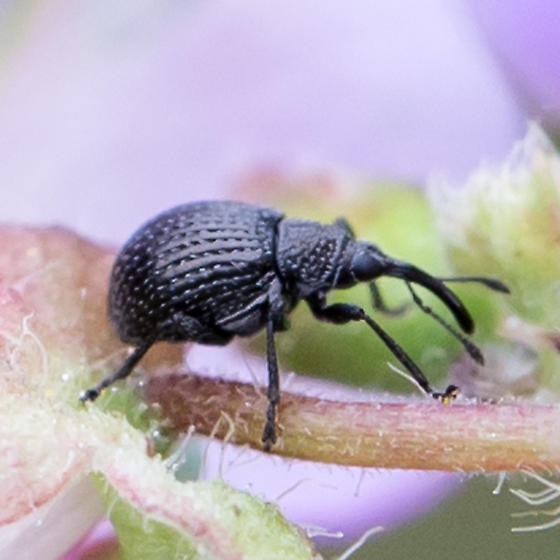
You are a GUI agent. You are given a task and a screenshot of the screen. Output one action in this format:
    pyautogui.click(x=<x>, y=<y>)
    Task: Click on the rostrum
    The width and height of the screenshot is (560, 560).
    Given the screenshot: What is the action you would take?
    pyautogui.click(x=416, y=270)